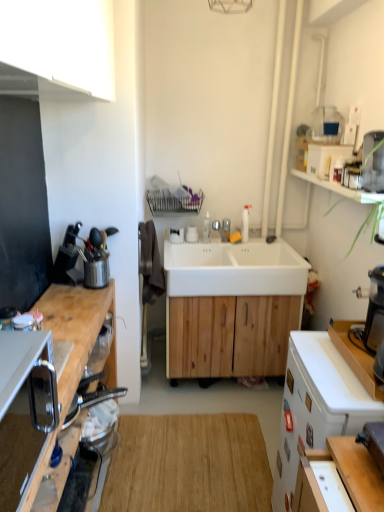
At what (x,y) coordinates should I click in order to perform the action: click on blank space above natural wood cutting board at center (from a real-world perspective). Please return your answer as a coordinate pair (x, y). This screenshot has height=512, width=384. Looking at the image, I should click on coord(192,455).